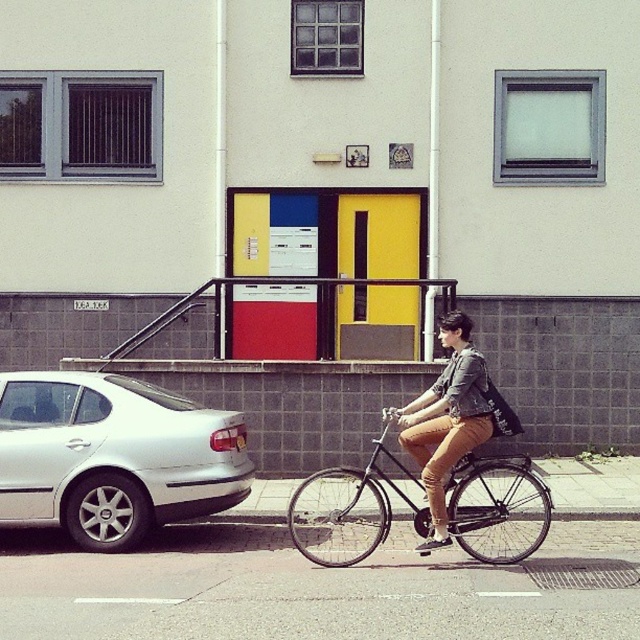
You are standing on the sidewalk and want to reach a point that is 32.30 feet away. The point is marked as point (486,512) in the image. Can you walk straight ahead to reach it without needing to move around any obstacles?

The point (486,512) is 32.30 feet away from the viewer. Since there are no obstacles mentioned in the scene description, you can walk straight ahead to reach it.

You are a pedestrian standing on the sidewalk and want to cross the street. You see a silver metallic car at left and a denim jacket at center. Which object is closer to you?

The silver metallic car at left is closer to you because it is further to the viewer than the denim jacket at center, meaning it is positioned in front of the denim jacket at center.

You are standing at the point marked by the coordinates point (113, 456). What object is located at that point?

The point (113, 456) indicates a silver metallic car at left.